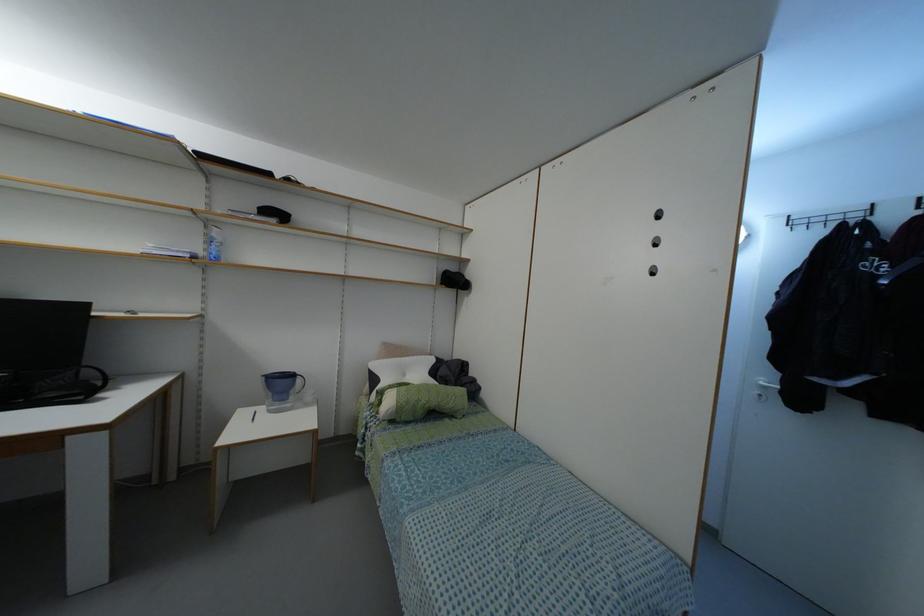
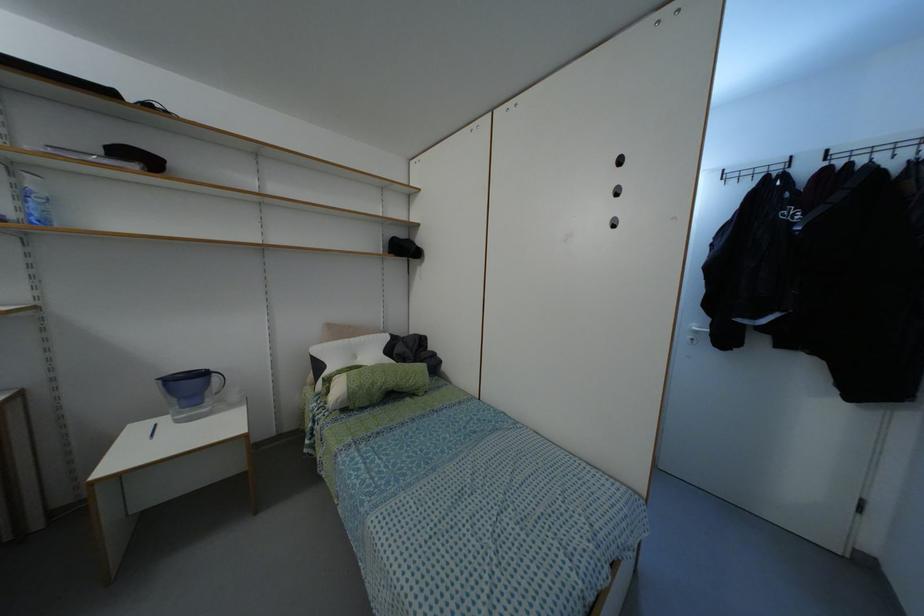
Where in the second image is the point corresponding to point (417, 400) from the first image?

(371, 384)